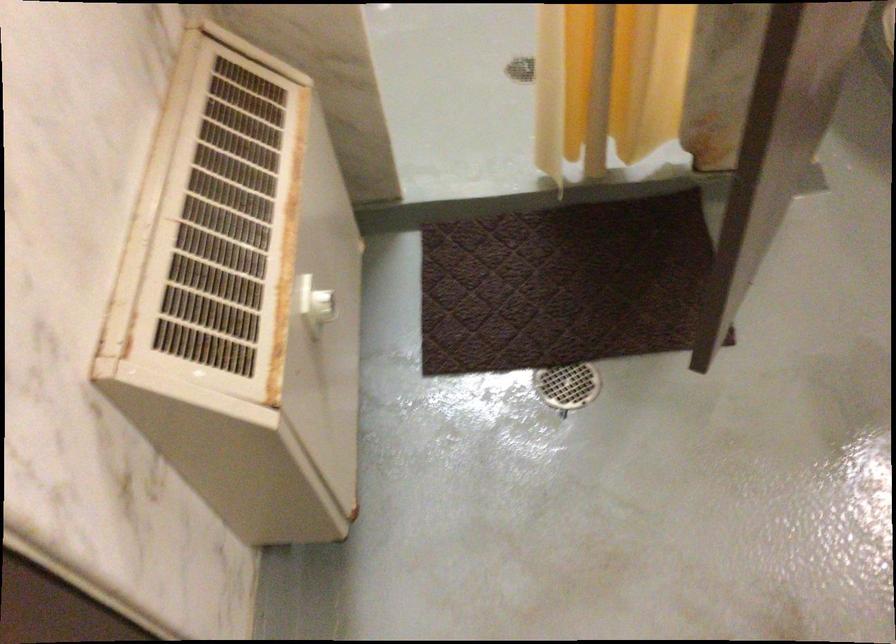
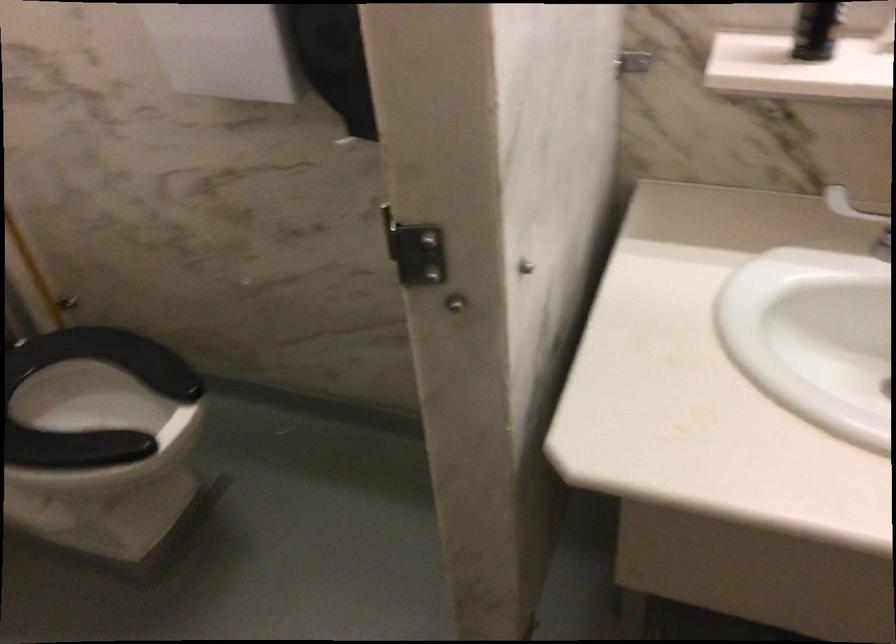
Question: The camera is either moving clockwise (left) or counter-clockwise (right) around the object. The first image is from the beginning of the video and the second image is from the end. Is the camera moving left or right when shooting the video?

Choices:
 (A) Left
 (B) Right

Answer: (A)